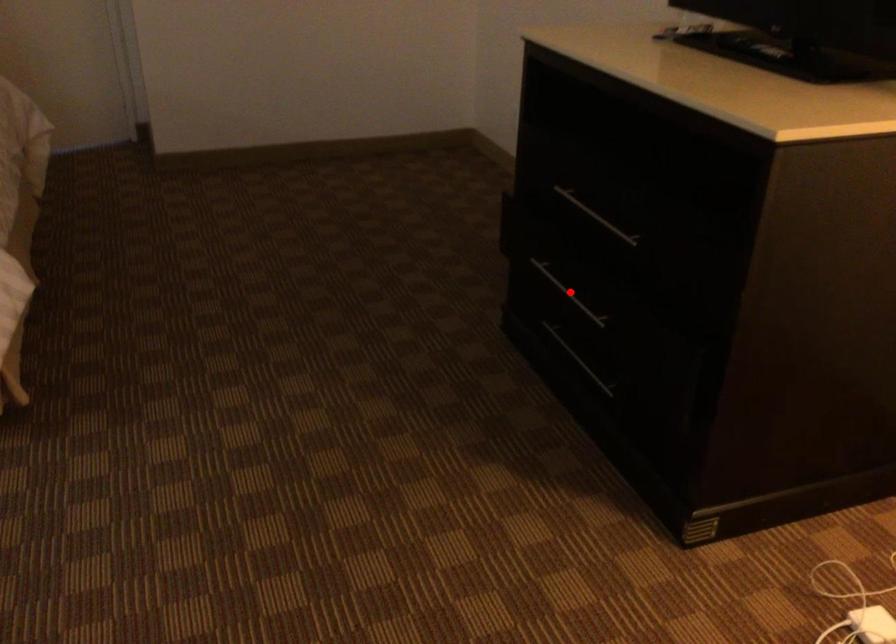
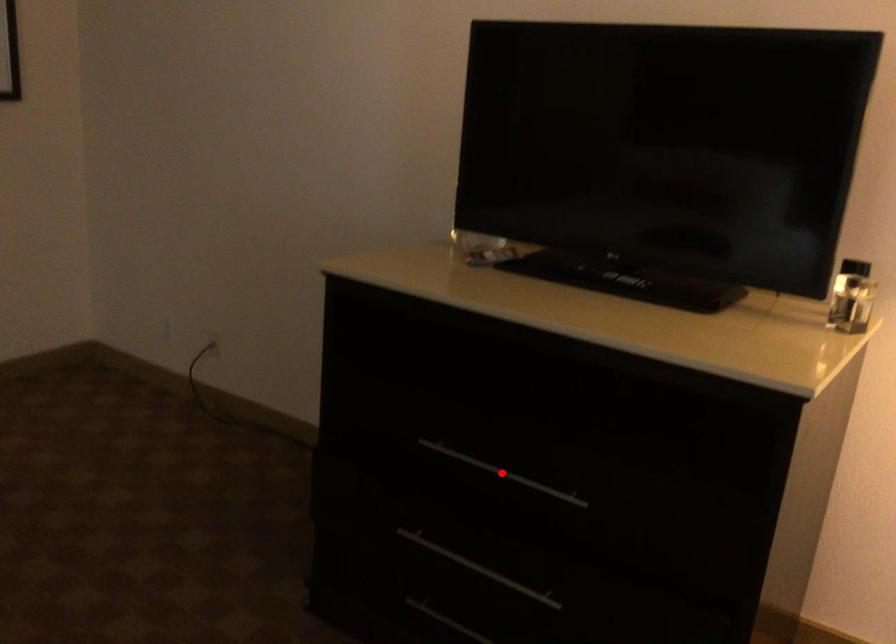
I am providing you with two images of the same scene from different viewpoints. A red point is marked on the first image and another point is marked on the second image. Are the points marked in image1 and image2 representing the same 3D position?

No